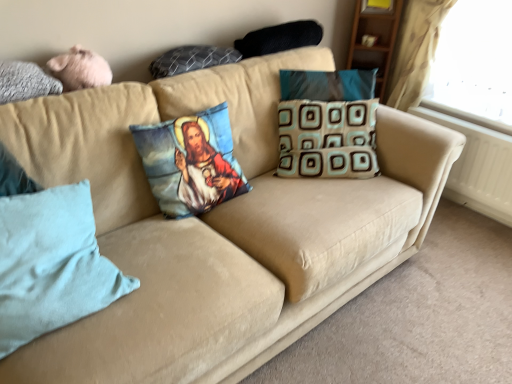
Question: Does point (291, 46) appear closer or farther from the camera than point (187, 69)?

Choices:
 (A) closer
 (B) farther

Answer: (B)

Question: Is black textured pillow at upper center, positioned as the first pillow in top-to-bottom order, wider or thinner than textured gray pillow at upper center, which is the second pillow in top-to-bottom order?

Choices:
 (A) thin
 (B) wide

Answer: (B)

Question: Which is farther from the gray textured pillow at upper left, which is the 3th pillow from top to bottom?

Choices:
 (A) textured fabric pillow at center, which is the second pillow in bottom-to-top order
 (B) translucent fabric at upper right
 (C) white plastic radiator at lower right
 (D) teal and brown patterned pillow at center, marked as the third pillow in a bottom-to-top arrangement
 (E) textured gray pillow at upper center, which appears as the 5th pillow when ordered from the bottom

Answer: (B)

Question: Which of these objects is positioned closest to the textured gray pillow at upper center, which appears as the 5th pillow when ordered from the bottom?

Choices:
 (A) light blue fabric pillow at lower left, the 6th pillow viewed from the top
 (B) black textured pillow at upper center, the sixth pillow positioned from the bottom
 (C) white plastic radiator at lower right
 (D) translucent fabric at upper right
 (E) teal and brown patterned pillow at center, arranged as the fourth pillow when viewed from the top

Answer: (B)